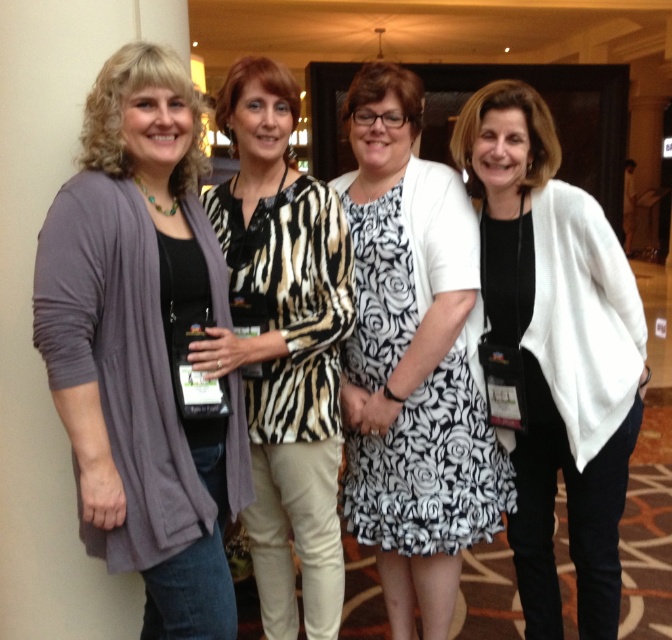
Question: Can you confirm if matte gray cardigan at left is bigger than white matte cardigan at right?

Choices:
 (A) no
 (B) yes

Answer: (A)

Question: Which of the following is the farthest from the observer?

Choices:
 (A) (235, 308)
 (B) (427, 291)

Answer: (B)

Question: Can you confirm if matte gray cardigan at left is wider than black floral dress at center?

Choices:
 (A) no
 (B) yes

Answer: (A)

Question: Based on their relative distances, which object is nearer to the zebra print blouse at center?

Choices:
 (A) matte gray cardigan at left
 (B) black floral dress at center
 (C) white matte cardigan at right

Answer: (B)

Question: Considering the real-world distances, which object is farthest from the white matte cardigan at right?

Choices:
 (A) matte gray cardigan at left
 (B) black floral dress at center
 (C) zebra print blouse at center

Answer: (A)

Question: Can you confirm if matte gray cardigan at left is smaller than black floral dress at center?

Choices:
 (A) no
 (B) yes

Answer: (B)